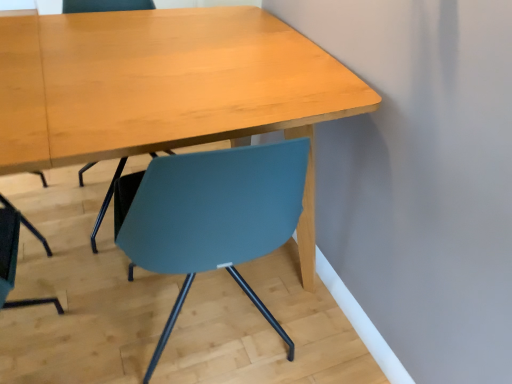
Where is `blank space situated above matte wood table at center (from a real-world perspective)`? blank space situated above matte wood table at center (from a real-world perspective) is located at coordinates (155, 56).